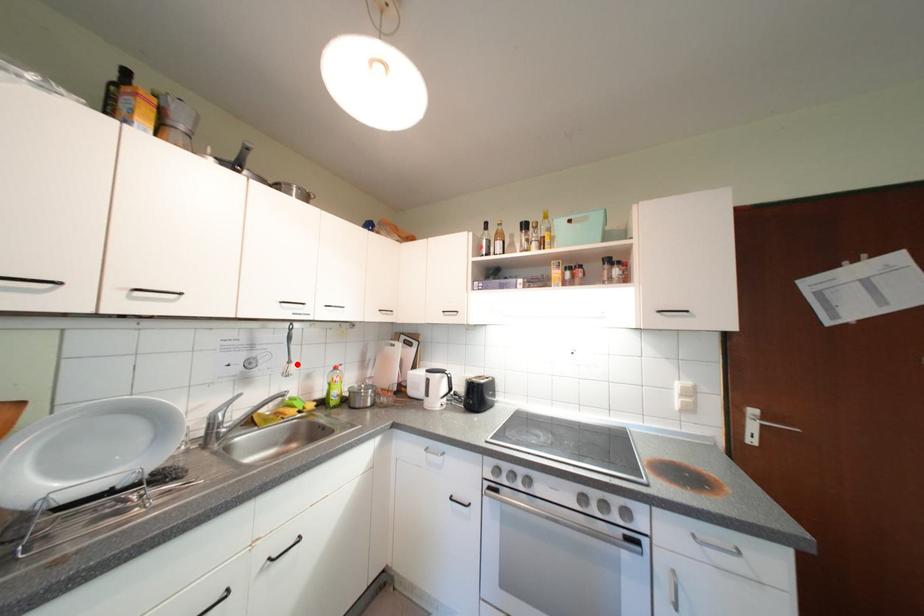
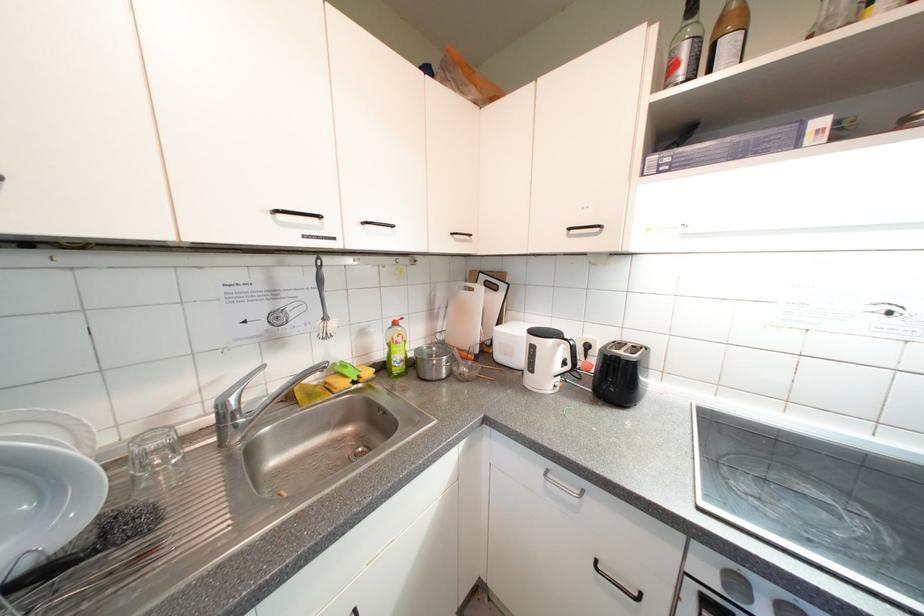
The point at the highlighted location is marked in the first image. Where is the corresponding point in the second image?

(333, 321)